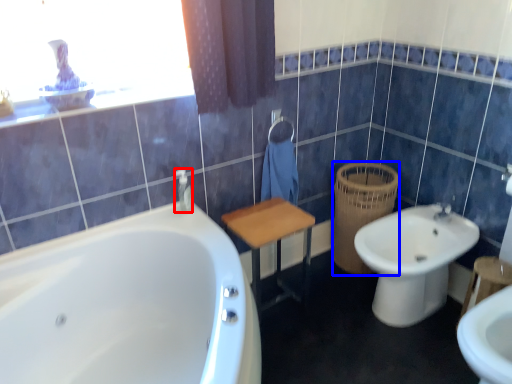
Question: Among these objects, which one is nearest to the camera, toiletry (highlighted by a red box) or basket (highlighted by a blue box)?

Choices:
 (A) toiletry
 (B) basket

Answer: (A)